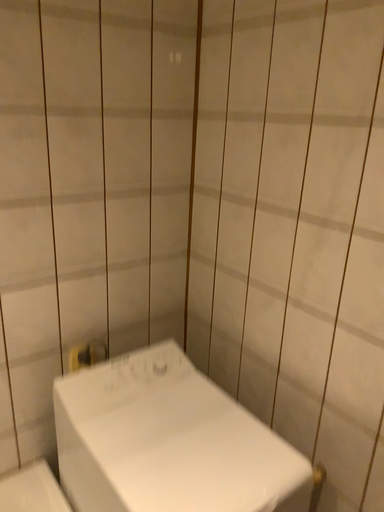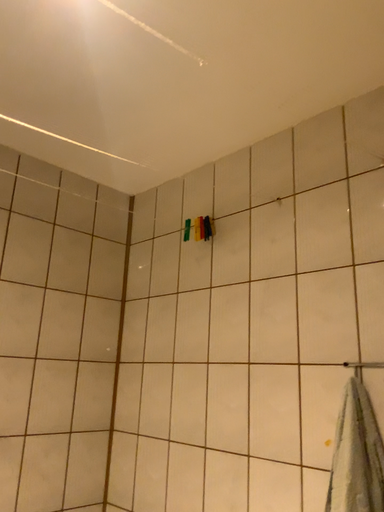
Question: How did the camera likely rotate when shooting the video?

Choices:
 (A) rotated left
 (B) rotated right

Answer: (B)